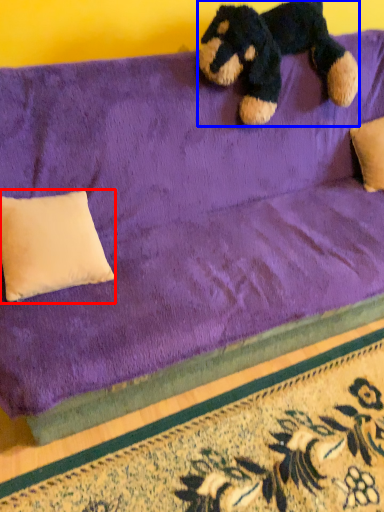
Question: Which of the following is the farthest to the observer, pillow (highlighted by a red box) or teddy bear (highlighted by a blue box)?

Choices:
 (A) pillow
 (B) teddy bear

Answer: (B)